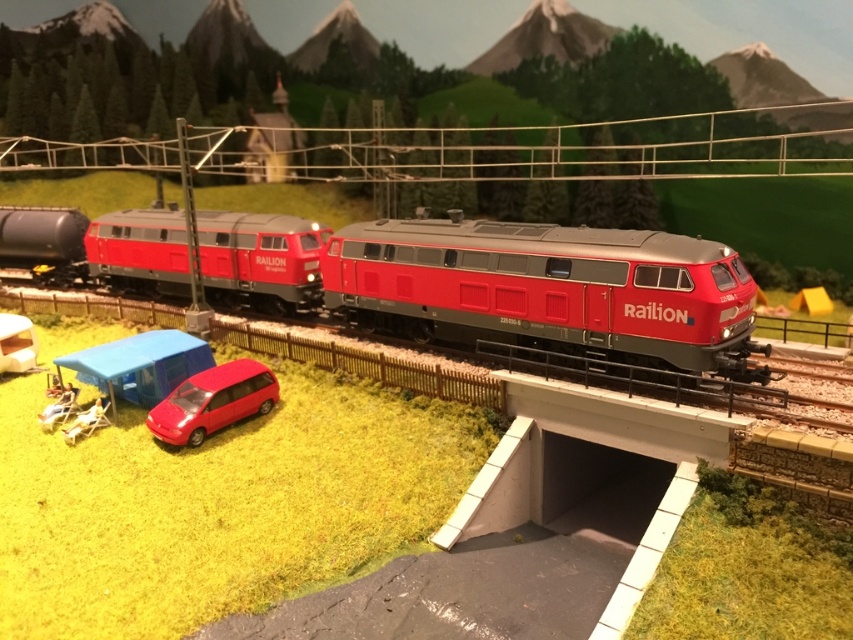
You are a toy collector who wants to display both the matte red locomotive at center and the glossy red minivan at lower center on a shelf. Given that the shelf has a height limit of 12 inches, can you determine if both items can be placed on the shelf without exceeding the height restriction?

The matte red locomotive at center has a greater height compared to the glossy red minivan at lower center. Since the shelf has a height limit of 12 inches, you need to ensure that the tallest item, the matte red locomotive at center, does not exceed this limit. If its height is within 12 inches, both items can be placed on the shelf.

You are a passenger waiting at the model railway station. You see the matte red locomotive at center and the glossy red minivan at lower center. Which vehicle is nearer to you?

The matte red locomotive at center is closer to the viewer than the glossy red minivan at lower center.